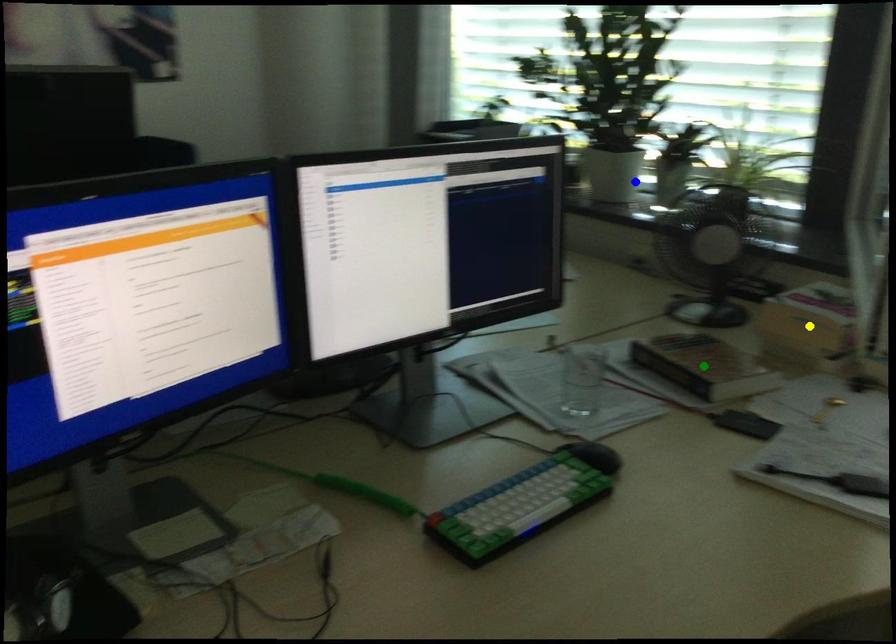
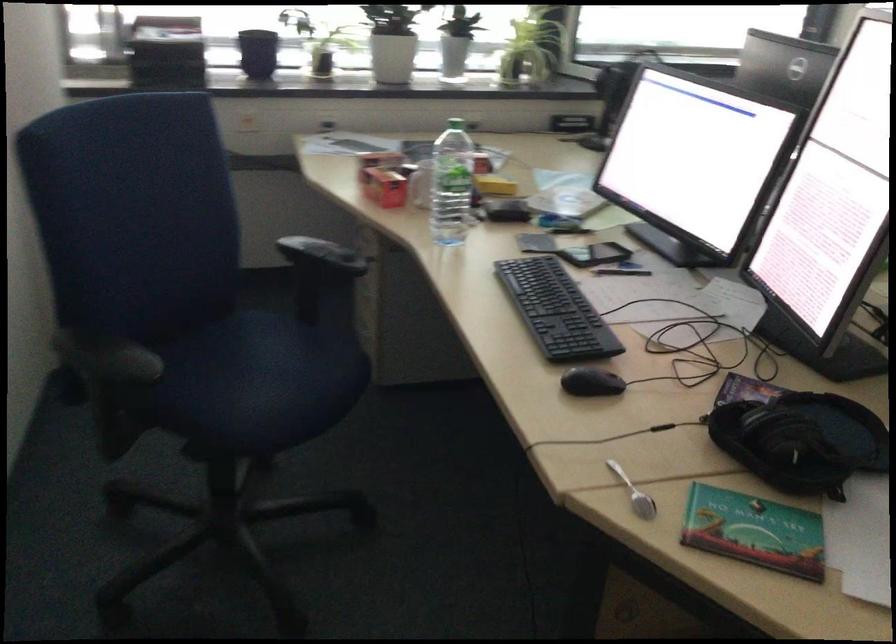
I am providing you with two images of the same scene from different viewpoints. Three points are marked in image1. Which point corresponds to a part or object that is occluded in image2?In image1, three points are marked. Which of them correspond to a part or object that is occluded in image2?Among the three points shown in image1, which one corresponds to a part or object that is no longer visible due to occlusion in image2?

Invisible in image2: green point, yellow point.